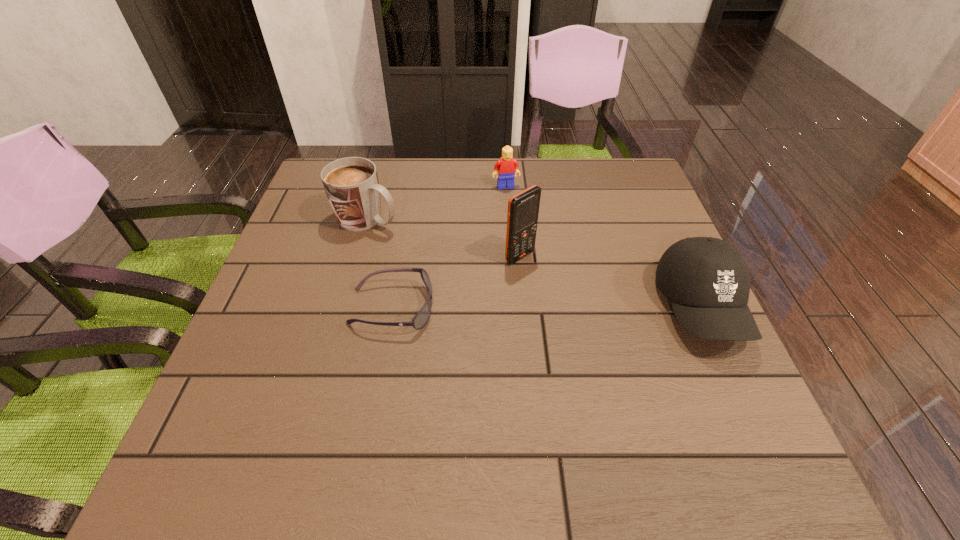
I want to click on vacant space in between the second farthest object and the baseball cap, so click(535, 263).

The height and width of the screenshot is (540, 960). Identify the location of free space between the farthest object and the second farthest object. (437, 202).

You are a GUI agent. You are given a task and a screenshot of the screen. Output one action in this format:
    pyautogui.click(x=<x>, y=<y>)
    Task: Click on the free space between the baseball cap and the sunglasses
    This screenshot has width=960, height=540.
    Given the screenshot: What is the action you would take?
    pyautogui.click(x=546, y=308)

Where is `free space between the tallest object and the mug`? free space between the tallest object and the mug is located at coordinates (444, 238).

Locate an element on the screen. This screenshot has height=540, width=960. free spot between the tallest object and the mug is located at coordinates (444, 238).

This screenshot has width=960, height=540. I want to click on vacant space that's between the second farthest object and the shortest object, so click(x=380, y=264).

Locate an element on the screen. The width and height of the screenshot is (960, 540). free spot between the shortest object and the tallest object is located at coordinates (456, 282).

Find the location of `the second closest object to the cellular telephone`. the second closest object to the cellular telephone is located at coordinates (507, 167).

Select which object is the fourth closest to the baseball cap. Please provide its 2D coordinates. Your answer should be formatted as a tuple, i.e. [(x, y)], where the tuple contains the x and y coordinates of a point satisfying the conditions above.

[(351, 184)]

You are a GUI agent. You are given a task and a screenshot of the screen. Output one action in this format:
    pyautogui.click(x=<x>, y=<y>)
    Task: Click on the free space that satisfies the following two spatial constraints: 1. on the front side of the mug; 2. on the lenses of the sunglasses
    The image size is (960, 540).
    Given the screenshot: What is the action you would take?
    pyautogui.click(x=343, y=308)